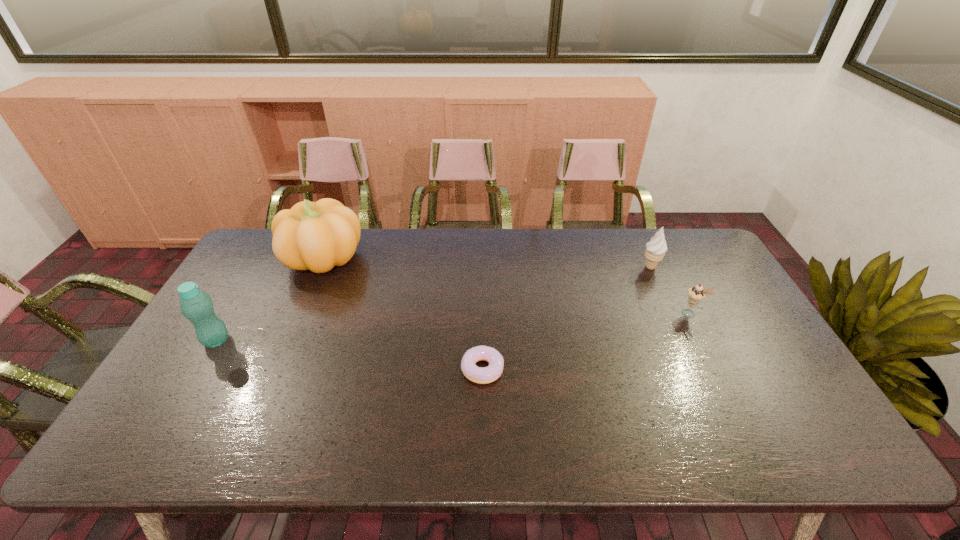
At what (x,y) coordinates should I click in order to perform the action: click on free space between the farther icecream and the nearer icecream. Please return your answer as a coordinate pair (x, y). The image size is (960, 540). Looking at the image, I should click on (670, 290).

This screenshot has height=540, width=960. In order to click on blank region between the water bottle and the third farthest object in this screenshot , I will do (x=453, y=327).

Find the location of a particular element. vacant point located between the shortest object and the leftmost object is located at coordinates (349, 355).

Locate an element on the screen. The height and width of the screenshot is (540, 960). free space between the third tallest object and the third object from right to left is located at coordinates (566, 318).

Locate an element on the screen. vacant space that's between the third object from left to right and the shorter icecream is located at coordinates (586, 341).

Where is `vacant space in between the third tallest object and the pumpkin`? The height and width of the screenshot is (540, 960). vacant space in between the third tallest object and the pumpkin is located at coordinates (487, 262).

Locate which object is the fourth closest to the taller icecream. Please provide its 2D coordinates. Your answer should be formatted as a tuple, i.e. [(x, y)], where the tuple contains the x and y coordinates of a point satisfying the conditions above.

[(196, 306)]

Locate an element on the screen. The height and width of the screenshot is (540, 960). object that is the closest to the fourth farthest object is located at coordinates coord(316,236).

At what (x,y) coordinates should I click in order to perform the action: click on blank area in the image that satisfies the following two spatial constraints: 1. on the front-facing side of the taller icecream; 2. on the right side of the nearer icecream. Please return your answer as a coordinate pair (x, y). Looking at the image, I should click on (672, 313).

Find the location of a particular element. Image resolution: width=960 pixels, height=540 pixels. free region that satisfies the following two spatial constraints: 1. on the front side of the pumpkin; 2. at the front cap of the second nearest object is located at coordinates (286, 341).